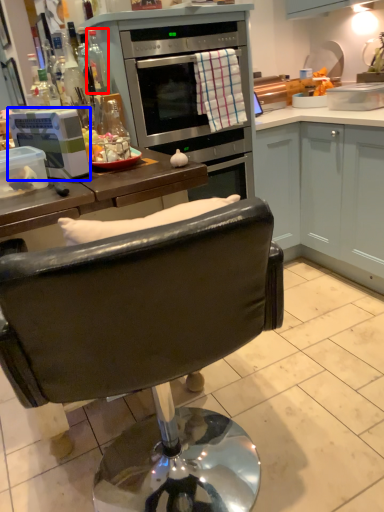
Question: Which point is further to the camera, bottle (highlighted by a red box) or kitchen appliance (highlighted by a blue box)?

Choices:
 (A) bottle
 (B) kitchen appliance

Answer: (A)